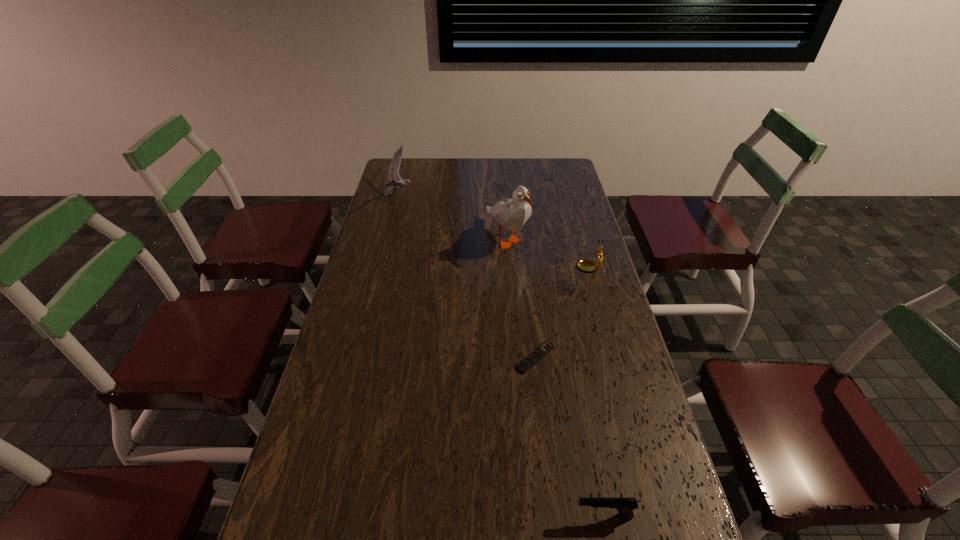
Locate an element on the screen. free area in between the second nearest object and the pocket watch is located at coordinates (564, 314).

Identify the location of vacant space that's between the remote control and the shorter gull. (468, 276).

Find the location of a particular element. Image resolution: width=960 pixels, height=540 pixels. free spot between the tallest object and the third tallest object is located at coordinates (549, 254).

Where is `free spot between the pistol and the pocket watch`? The width and height of the screenshot is (960, 540). free spot between the pistol and the pocket watch is located at coordinates (597, 393).

Locate an element on the screen. The height and width of the screenshot is (540, 960). free spot between the remote control and the nearest object is located at coordinates (569, 436).

Locate an element on the screen. This screenshot has height=540, width=960. vacant space in between the shortest object and the taller gull is located at coordinates (521, 298).

Identify the location of free spot between the shorter gull and the third shortest object. The height and width of the screenshot is (540, 960). (495, 233).

This screenshot has width=960, height=540. In order to click on vacant space that is in between the remote control and the right gull in this screenshot , I will do `click(521, 298)`.

You are a GUI agent. You are given a task and a screenshot of the screen. Output one action in this format:
    pyautogui.click(x=<x>, y=<y>)
    Task: Click on the vacant area that lies between the remote control and the tallest object
    The height and width of the screenshot is (540, 960).
    Given the screenshot: What is the action you would take?
    tap(521, 298)

This screenshot has width=960, height=540. I want to click on object identified as the closest to the nearest object, so click(x=533, y=358).